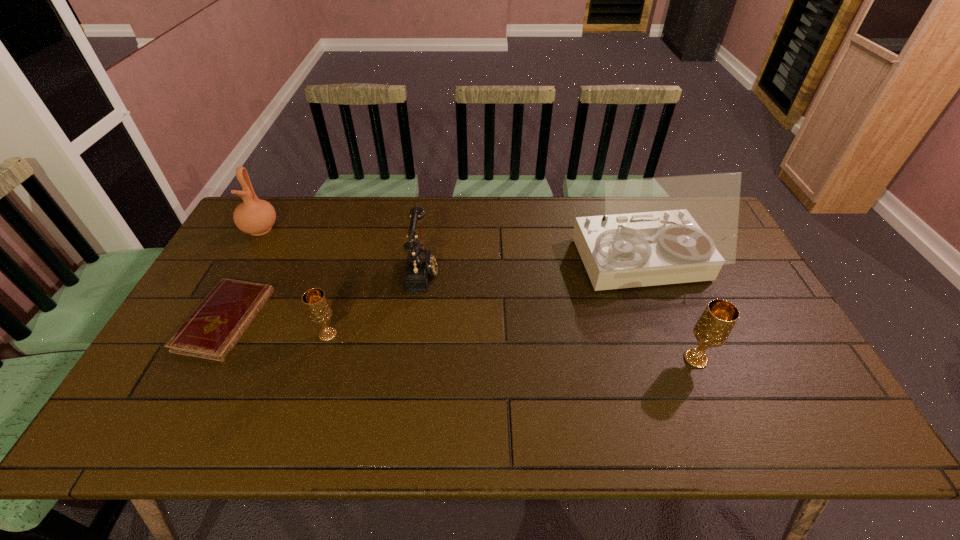
The height and width of the screenshot is (540, 960). Find the location of `the farther chalice`. the farther chalice is located at coordinates (315, 302).

The image size is (960, 540). What are the coordinates of `the shorter chalice` in the screenshot? It's located at pyautogui.click(x=315, y=302).

Where is `the taller chalice`? This screenshot has height=540, width=960. the taller chalice is located at coordinates (712, 329).

What are the coordinates of `the nearer chalice` in the screenshot? It's located at click(x=712, y=329).

Identify the location of pottery. This screenshot has height=540, width=960. (254, 216).

This screenshot has width=960, height=540. I want to click on telephone, so click(x=420, y=264).

This screenshot has width=960, height=540. Find the location of `the tallest object`. the tallest object is located at coordinates (665, 230).

Image resolution: width=960 pixels, height=540 pixels. Find the location of `the shortest object`. the shortest object is located at coordinates (213, 329).

This screenshot has height=540, width=960. In order to click on vacant space located on the front of the shorter chalice in this screenshot , I will do `click(313, 384)`.

Identify the location of free space located 0.120m on the right of the right chalice. The height and width of the screenshot is (540, 960). (757, 359).